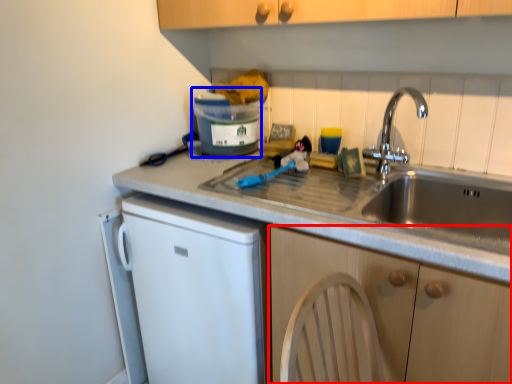
Question: Which object appears farthest to the camera in this image, cabinetry (highlighted by a red box) or appliance (highlighted by a blue box)?

Choices:
 (A) cabinetry
 (B) appliance

Answer: (B)